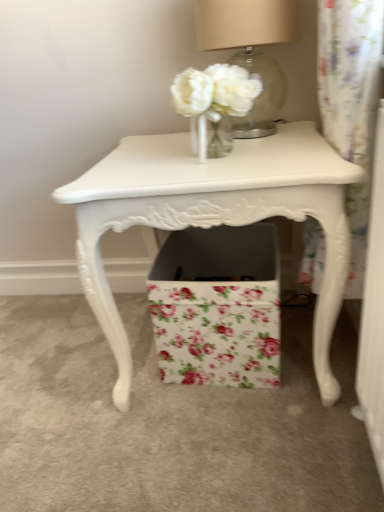
This screenshot has width=384, height=512. Describe the element at coordinates (218, 306) in the screenshot. I see `floral paper box at center` at that location.

The height and width of the screenshot is (512, 384). Identify the location of white painted wood table at center. (214, 215).

Considering the relative positions of matte beige lampshade at upper center and floral paper box at center in the image provided, is matte beige lampshade at upper center behind floral paper box at center?

No.

Considering the positions of points (248, 45) and (268, 365), is point (248, 45) farther from camera compared to point (268, 365)?

No.

Based on the photo, which of these two, matte beige lampshade at upper center or floral paper box at center, is smaller?

matte beige lampshade at upper center is smaller.

From a real-world perspective, which object rests below the other?

In real-world perspective, floral paper box at center is lower.

In the scene shown: From the image's perspective, which is below, floral paper box at center or matte beige lampshade at upper center?

From the image's view, floral paper box at center is below.

Would you say floral paper box at center is a long distance from matte beige lampshade at upper center?

No, floral paper box at center is not far from matte beige lampshade at upper center.

Is floral paper box at center outside of matte beige lampshade at upper center?

Yes.

Is matte beige lampshade at upper center at the back of floral paper box at center?

That's not correct — floral paper box at center is not looking away from matte beige lampshade at upper center.

Is floral paper box at center at the back of white painted wood table at center?

Yes, white painted wood table at center is facing away from floral paper box at center.

Is white painted wood table at center at the left side of floral paper box at center?

Yes, white painted wood table at center is to the left of floral paper box at center.

Is white painted wood table at center next to floral paper box at center?

No, white painted wood table at center is not beside floral paper box at center.

The image size is (384, 512). In order to click on cardboard box below the white painted wood table at center (from the image's perspective) in this screenshot , I will do `click(218, 306)`.

Can you confirm if floral paper box at center is thinner than white painted wood table at center?

Yes, floral paper box at center is thinner than white painted wood table at center.

Looking at the image, does floral paper box at center seem bigger or smaller compared to white painted wood table at center?

floral paper box at center is smaller than white painted wood table at center.

Is white painted wood table at center at the back of floral paper box at center?

That's right, floral paper box at center is facing away from white painted wood table at center.

Is white painted wood table at center facing away from matte beige lampshade at upper center?

No, matte beige lampshade at upper center is not at the back of white painted wood table at center.

Considering the sizes of white painted wood table at center and matte beige lampshade at upper center in the image, is white painted wood table at center taller or shorter than matte beige lampshade at upper center?

Considering their sizes, white painted wood table at center has more height than matte beige lampshade at upper center.

Measure the distance from white painted wood table at center to matte beige lampshade at upper center.

white painted wood table at center and matte beige lampshade at upper center are 11.29 inches apart.

Choose the correct answer: Is white painted wood table at center inside matte beige lampshade at upper center or outside it?

white painted wood table at center is not enclosed by matte beige lampshade at upper center.

Is matte beige lampshade at upper center in front of white painted wood table at center?

No, matte beige lampshade at upper center is further to the viewer.

Is matte beige lampshade at upper center not inside white painted wood table at center?

matte beige lampshade at upper center is positioned outside white painted wood table at center.

Which object is wider, matte beige lampshade at upper center or white painted wood table at center?

white painted wood table at center.

Where is `table lamp located above the floral paper box at center (from a real-world perspective)`? table lamp located above the floral paper box at center (from a real-world perspective) is located at coordinates (251, 51).

Where is `table lamp that appears above the floral paper box at center (from the image's perspective)`? This screenshot has width=384, height=512. table lamp that appears above the floral paper box at center (from the image's perspective) is located at coordinates (251, 51).

Estimate the real-world distances between objects in this image. Which object is further from matte beige lampshade at upper center, white painted wood table at center or floral paper box at center?

The object further to matte beige lampshade at upper center is floral paper box at center.

When comparing their distances from white painted wood table at center, does floral paper box at center or matte beige lampshade at upper center seem further?

matte beige lampshade at upper center is further to white painted wood table at center.

Based on their spatial positions, is white painted wood table at center or matte beige lampshade at upper center closer to floral paper box at center?

white painted wood table at center is closer to floral paper box at center.

Estimate the real-world distances between objects in this image. Which object is closer to matte beige lampshade at upper center, floral paper box at center or white painted wood table at center?

Among the two, white painted wood table at center is located nearer to matte beige lampshade at upper center.

From the picture: Based on their spatial positions, is matte beige lampshade at upper center or floral paper box at center closer to white painted wood table at center?

floral paper box at center.

Based on their spatial positions, is matte beige lampshade at upper center or white painted wood table at center closer to floral paper box at center?

white painted wood table at center is positioned closer to the anchor floral paper box at center.

At what (x,y) coordinates should I click in order to perform the action: click on table between matte beige lampshade at upper center and floral paper box at center in the up-down direction. Please return your answer as a coordinate pair (x, y). This screenshot has height=512, width=384. Looking at the image, I should click on (214, 215).